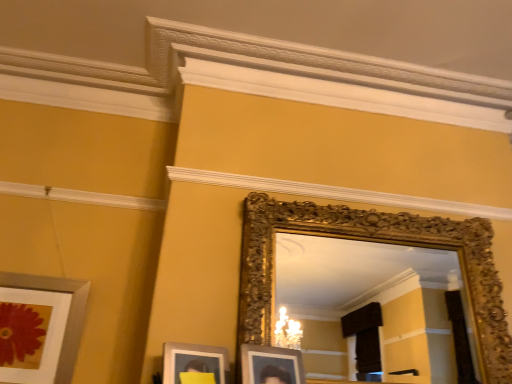
What do you see at coordinates (40, 327) in the screenshot?
I see `silver metallic picture frame at lower left` at bounding box center [40, 327].

The width and height of the screenshot is (512, 384). I want to click on silver metallic picture frame at lower left, so click(x=40, y=327).

The height and width of the screenshot is (384, 512). In order to click on gold ornate mirror at upper center in this screenshot , I will do `click(368, 303)`.

Describe the element at coordinates (368, 303) in the screenshot. I see `gold ornate mirror at upper center` at that location.

Find the location of a particular element. The height and width of the screenshot is (384, 512). silver metallic picture frame at lower left is located at coordinates (40, 327).

Is silver metallic picture frame at lower left to the left of gold ornate mirror at upper center from the viewer's perspective?

Yes.

In the image, is silver metallic picture frame at lower left positioned in front of or behind gold ornate mirror at upper center?

In the image, silver metallic picture frame at lower left appears behind gold ornate mirror at upper center.

Is point (8, 275) closer to viewer compared to point (317, 289)?

Yes, point (8, 275) is in front of point (317, 289).

From the image's perspective, is silver metallic picture frame at lower left located above or below gold ornate mirror at upper center?

silver metallic picture frame at lower left is situated lower than gold ornate mirror at upper center in the image.

From a real-world perspective, who is located lower, silver metallic picture frame at lower left or gold ornate mirror at upper center?

silver metallic picture frame at lower left is physically lower.

Which object is thinner, silver metallic picture frame at lower left or gold ornate mirror at upper center?

silver metallic picture frame at lower left.

Who is shorter, silver metallic picture frame at lower left or gold ornate mirror at upper center?

With less height is silver metallic picture frame at lower left.

In terms of size, does silver metallic picture frame at lower left appear bigger or smaller than gold ornate mirror at upper center?

Clearly, silver metallic picture frame at lower left is smaller in size than gold ornate mirror at upper center.

Is gold ornate mirror at upper center located within silver metallic picture frame at lower left?

Actually, gold ornate mirror at upper center is outside silver metallic picture frame at lower left.

Is silver metallic picture frame at lower left next to gold ornate mirror at upper center and touching it?

No, silver metallic picture frame at lower left is not next to gold ornate mirror at upper center.

Does silver metallic picture frame at lower left turn towards gold ornate mirror at upper center?

No, silver metallic picture frame at lower left is not aimed at gold ornate mirror at upper center.

The image size is (512, 384). I want to click on mirror on the right of silver metallic picture frame at lower left, so click(x=368, y=303).

Which is more to the left, gold ornate mirror at upper center or silver metallic picture frame at lower left?

Positioned to the left is silver metallic picture frame at lower left.

Does gold ornate mirror at upper center come behind silver metallic picture frame at lower left?

No, gold ornate mirror at upper center is closer to the camera.

Does point (346, 296) appear closer or farther from the camera than point (22, 373)?

Point (346, 296) appears to be farther away from the viewer than point (22, 373).

From the image's perspective, is gold ornate mirror at upper center located above silver metallic picture frame at lower left?

Yes, from the image's perspective, gold ornate mirror at upper center is above silver metallic picture frame at lower left.

From a real-world perspective, which is physically below, gold ornate mirror at upper center or silver metallic picture frame at lower left?

From a 3D spatial view, silver metallic picture frame at lower left is below.

In the scene shown: Considering the sizes of objects gold ornate mirror at upper center and silver metallic picture frame at lower left in the image provided, who is thinner, gold ornate mirror at upper center or silver metallic picture frame at lower left?

silver metallic picture frame at lower left is thinner.

Does gold ornate mirror at upper center have a lesser height compared to silver metallic picture frame at lower left?

No.

Does gold ornate mirror at upper center have a larger size compared to silver metallic picture frame at lower left?

Correct, gold ornate mirror at upper center is larger in size than silver metallic picture frame at lower left.

Is gold ornate mirror at upper center situated inside silver metallic picture frame at lower left or outside?

gold ornate mirror at upper center is not enclosed by silver metallic picture frame at lower left.

Is gold ornate mirror at upper center not close to silver metallic picture frame at lower left?

Yes.

Is gold ornate mirror at upper center oriented towards silver metallic picture frame at lower left?

No, gold ornate mirror at upper center is not oriented towards silver metallic picture frame at lower left.

At what (x,y) coordinates should I click in order to perform the action: click on mirror on the right of the silver metallic picture frame at lower left. Please return your answer as a coordinate pair (x, y). Looking at the image, I should click on (368, 303).

Find the location of `mirror above the silver metallic picture frame at lower left (from the image's perspective)`. mirror above the silver metallic picture frame at lower left (from the image's perspective) is located at coordinates (368, 303).

Find the location of a particular element. The image size is (512, 384). mirror in front of the silver metallic picture frame at lower left is located at coordinates (368, 303).